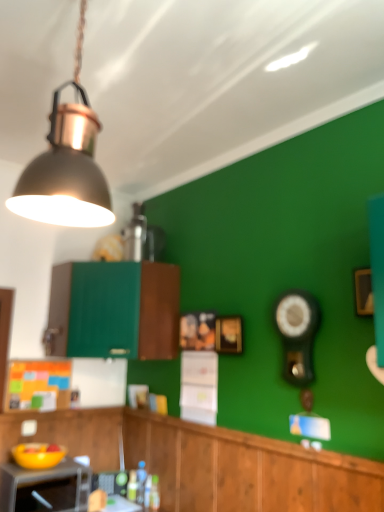
Describe the element at coordinates (208, 461) in the screenshot. I see `wooden cabinet at lower center, which is the 1th cabinetry from bottom to top` at that location.

Measure the distance between point (314, 319) and camera.

1.98 meters.

This screenshot has height=512, width=384. In order to click on translucent plastic bottle at lower center in this screenshot , I will do `click(141, 481)`.

What do you see at coordinates (67, 163) in the screenshot? I see `metallic gray lampshade at upper left` at bounding box center [67, 163].

Image resolution: width=384 pixels, height=512 pixels. What do you see at coordinates (115, 310) in the screenshot? I see `green matte cabinet at center, marked as the first cabinetry in a top-to-bottom arrangement` at bounding box center [115, 310].

Locate an element on the screen. The image size is (384, 512). wooden cabinet at lower center, which is the 1th cabinetry from bottom to top is located at coordinates (208, 461).

From the image's perspective, would you say gold metallic picture frame at center is shown under metallic gray lampshade at upper left?

Yes.

Is gold metallic picture frame at center not near metallic gray lampshade at upper left?

Yes.

Is gold metallic picture frame at center outside of metallic gray lampshade at upper left?

Yes.

Is gold metallic picture frame at center smaller than metallic gray lampshade at upper left?

Result: Yes, gold metallic picture frame at center is smaller than metallic gray lampshade at upper left.

Measure the distance from wooden cabinet at lower center, which is the 1th cabinetry from bottom to top, to black glossy clock at right.

27.83 inches.

Based on their sizes in the image, would you say wooden cabinet at lower center, which appears as the 2th cabinetry when viewed from the top, is bigger or smaller than black glossy clock at right?

In the image, wooden cabinet at lower center, which appears as the 2th cabinetry when viewed from the top, appears to be larger than black glossy clock at right.

From the image's perspective, is wooden cabinet at lower center, which is the 1th cabinetry from bottom to top, above black glossy clock at right?

No, from the image's perspective, wooden cabinet at lower center, which is the 1th cabinetry from bottom to top, is not over black glossy clock at right.

Is the surface of wooden cabinet at lower center, which appears as the 2th cabinetry when viewed from the top, in direct contact with black glossy clock at right?

There is a gap between wooden cabinet at lower center, which appears as the 2th cabinetry when viewed from the top, and black glossy clock at right.

Does point (97, 333) come closer to viewer compared to point (29, 476)?

No, (97, 333) is behind (29, 476).

Is green matte cabinet at center, acting as the second cabinetry starting from the bottom, taller than matte black microwave at lower left?

Yes.

Between green matte cabinet at center, marked as the first cabinetry in a top-to-bottom arrangement, and matte black microwave at lower left, which one appears on the right side from the viewer's perspective?

green matte cabinet at center, marked as the first cabinetry in a top-to-bottom arrangement, is more to the right.

Considering the relative sizes of green matte cabinet at center, acting as the second cabinetry starting from the bottom, and matte black microwave at lower left in the image provided, is green matte cabinet at center, acting as the second cabinetry starting from the bottom, bigger than matte black microwave at lower left?

Yes.

Is black glossy clock at right thinner than green matte cabinet at center, acting as the second cabinetry starting from the bottom?

Yes.

Considering the sizes of objects black glossy clock at right and green matte cabinet at center, acting as the second cabinetry starting from the bottom, in the image provided, who is shorter, black glossy clock at right or green matte cabinet at center, acting as the second cabinetry starting from the bottom,?

With less height is black glossy clock at right.

Which is more to the right, black glossy clock at right or green matte cabinet at center, acting as the second cabinetry starting from the bottom?

black glossy clock at right is more to the right.

Is black glossy clock at right to the left or to the right of matte black microwave at lower left in the image?

black glossy clock at right is to the right of matte black microwave at lower left.

Between point (296, 335) and point (65, 479), which one is positioned in front?

Positioned in front is point (296, 335).

From a real-world perspective, between black glossy clock at right and matte black microwave at lower left, who is vertically higher?

In real-world perspective, black glossy clock at right is above.

Between black glossy clock at right and matte black microwave at lower left, which one is positioned in front?

black glossy clock at right is more forward.

Is metallic gray lampshade at upper left not inside wooden cabinet at lower center, which appears as the 2th cabinetry when viewed from the top?

Yes, metallic gray lampshade at upper left is located beyond the bounds of wooden cabinet at lower center, which appears as the 2th cabinetry when viewed from the top.

From the image's perspective, which object appears higher, metallic gray lampshade at upper left or wooden cabinet at lower center, which appears as the 2th cabinetry when viewed from the top?

metallic gray lampshade at upper left is shown above in the image.

Is metallic gray lampshade at upper left looking in the opposite direction of wooden cabinet at lower center, which appears as the 2th cabinetry when viewed from the top?

No, wooden cabinet at lower center, which appears as the 2th cabinetry when viewed from the top, is not at the back of metallic gray lampshade at upper left.

Based on the photo, is metallic gray lampshade at upper left wider or thinner than black glossy clock at right?

metallic gray lampshade at upper left is wider than black glossy clock at right.

Based on the photo, is metallic gray lampshade at upper left positioned with its back to black glossy clock at right?

No.

Relative to black glossy clock at right, is metallic gray lampshade at upper left in front or behind?

Clearly, metallic gray lampshade at upper left is in front of black glossy clock at right.

The height and width of the screenshot is (512, 384). Identify the location of picture frame that appears on the right of metallic gray lampshade at upper left. [229, 334].

Where is `cabinetry located in front of the black glossy clock at right`? This screenshot has height=512, width=384. cabinetry located in front of the black glossy clock at right is located at coordinates (208, 461).

Considering their positions, is green matte cabinet at center, marked as the first cabinetry in a top-to-bottom arrangement, positioned closer to gold metallic picture frame at center than black glossy clock at right?

Among the two, black glossy clock at right is located nearer to gold metallic picture frame at center.

Considering their positions, is translucent plastic bottle at lower center positioned further to green matte cabinet at center, acting as the second cabinetry starting from the bottom, than gold metallic picture frame at center?

The object further to green matte cabinet at center, acting as the second cabinetry starting from the bottom, is translucent plastic bottle at lower center.

Which object lies further to the anchor point green matte cabinet at center, marked as the first cabinetry in a top-to-bottom arrangement, black glossy clock at right or gold metallic picture frame at center?

black glossy clock at right is positioned further to the anchor green matte cabinet at center, marked as the first cabinetry in a top-to-bottom arrangement.

Based on their spatial positions, is metallic gray lampshade at upper left or matte black microwave at lower left closer to gold metallic picture frame at center?

Based on the image, matte black microwave at lower left appears to be nearer to gold metallic picture frame at center.

Estimate the real-world distances between objects in this image. Which object is further from black glossy clock at right, wooden cabinet at lower center, which appears as the 2th cabinetry when viewed from the top, or green matte cabinet at center, marked as the first cabinetry in a top-to-bottom arrangement?

green matte cabinet at center, marked as the first cabinetry in a top-to-bottom arrangement, lies further to black glossy clock at right than the other object.

Which object lies nearer to the anchor point gold metallic picture frame at center, black glossy clock at right or translucent plastic bottle at lower center?

black glossy clock at right is positioned closer to the anchor gold metallic picture frame at center.

When comparing their distances from matte black microwave at lower left, does wooden cabinet at lower center, which is the 1th cabinetry from bottom to top, or gold metallic picture frame at center seem further?

gold metallic picture frame at center is further to matte black microwave at lower left.

Looking at the image, which one is located further to green matte cabinet at center, acting as the second cabinetry starting from the bottom, translucent plastic bottle at lower center or matte black microwave at lower left?

translucent plastic bottle at lower center is positioned further to the anchor green matte cabinet at center, acting as the second cabinetry starting from the bottom.

The height and width of the screenshot is (512, 384). In order to click on cabinetry between green matte cabinet at center, marked as the first cabinetry in a top-to-bottom arrangement, and matte black microwave at lower left vertically in this screenshot , I will do `click(208, 461)`.

The width and height of the screenshot is (384, 512). Find the location of `bottle between matte black microwave at lower left and black glossy clock at right`. bottle between matte black microwave at lower left and black glossy clock at right is located at coordinates [141, 481].

What are the coordinates of `appliance that lies between green matte cabinet at center, acting as the second cabinetry starting from the bottom, and translucent plastic bottle at lower center from top to bottom` in the screenshot? It's located at (45, 487).

Locate an element on the screen. Image resolution: width=384 pixels, height=512 pixels. picture frame that lies between black glossy clock at right and translucent plastic bottle at lower center from top to bottom is located at coordinates (229, 334).